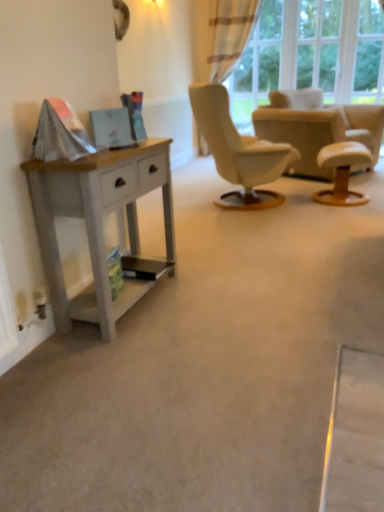
In order to click on vacant area located to the right-hand side of white wood desk at left in this screenshot , I will do `click(214, 298)`.